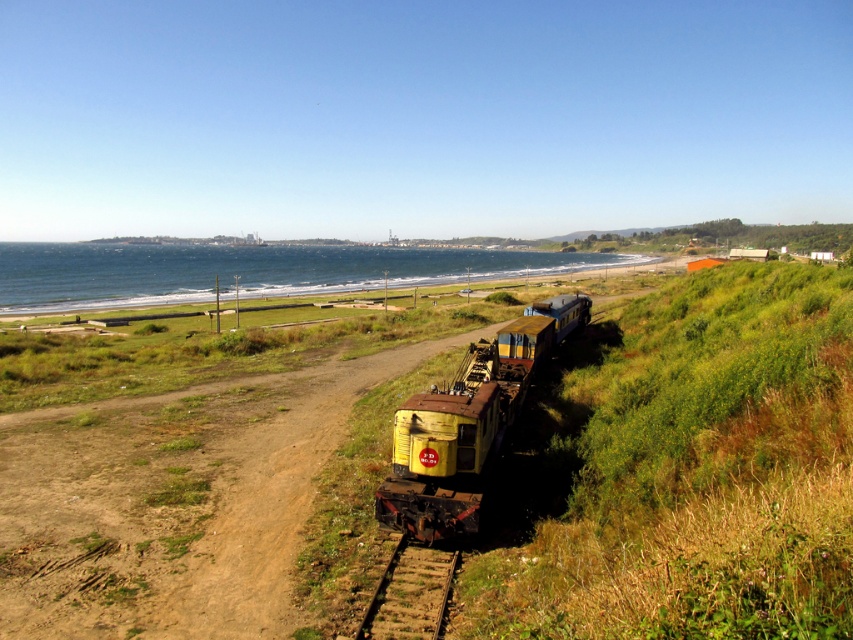
You are standing at the starting point of the railway track and want to reach a point that is closer to you. Which point should you head towards, point (846,397) or point (421,572)?

Point (846,397) is closer to the viewer than point (421,572), so you should head towards point (846,397).

You are a train engineer trying to determine the position of two points along the railway tracks in the image. The first point is labeled as point (444, 509) and the second is point (380, 589). Based on the railway tracks shown, which point is closer to the horizon?

Point (444, 509) is behind point (380, 589), so point (444, 509) is closer to the horizon since it is positioned further along the tracks towards the horizon.